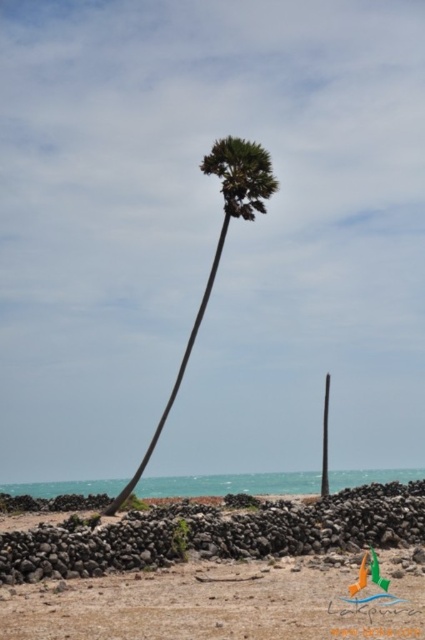
Question: Which of the following is the closest to the observer?

Choices:
 (A) green smooth pole at center
 (B) brown sandy beach at lower center

Answer: (B)

Question: Does brown sandy beach at lower center come behind green smooth pole at center?

Choices:
 (A) no
 (B) yes

Answer: (A)

Question: Is green leafy palm tree at center closer to camera compared to green smooth pole at center?

Choices:
 (A) no
 (B) yes

Answer: (B)

Question: Is brown sandy beach at lower center thinner than green smooth pole at center?

Choices:
 (A) no
 (B) yes

Answer: (A)

Question: Which of the following is the closest to the observer?

Choices:
 (A) (139, 600)
 (B) (326, 438)
 (C) (232, 205)

Answer: (A)

Question: Which point appears closest to the camera in this image?

Choices:
 (A) (135, 483)
 (B) (45, 586)
 (C) (328, 406)

Answer: (B)